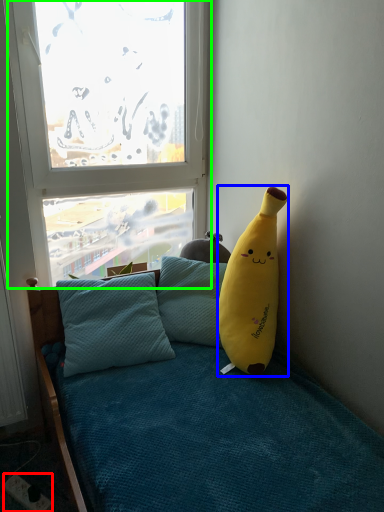
Question: Which object is the farthest from power outlet (highlighted by a red box)? Choose among these: banana (highlighted by a blue box) or window (highlighted by a green box).

Choices:
 (A) banana
 (B) window

Answer: (B)